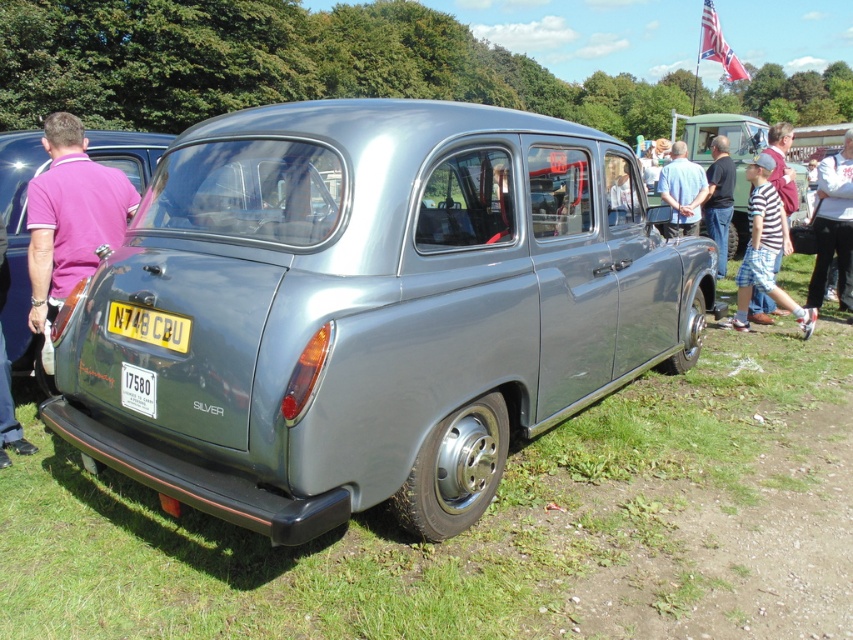
Is point (65, 195) behind point (151, 324)?

Yes, point (65, 195) is farther from viewer.

Which is in front, point (117, 208) or point (131, 324)?

Point (131, 324) is in front.

I want to click on purple cotton polo shirt at rear, so click(70, 216).

In order to click on satin silver car at center in this screenshot , I will do `click(370, 308)`.

Is satin silver car at center in front of blue shirt at center?

Yes.

Which is in front, point (575, 317) or point (669, 186)?

Point (575, 317) is more forward.

Identify the location of satin silver car at center. The image size is (853, 640). (370, 308).

Can you confirm if striped fabric shirt at right is thinner than black fabric shirt at center?

In fact, striped fabric shirt at right might be wider than black fabric shirt at center.

Is point (786, 237) less distant than point (711, 184)?

That is True.

Where is `striped fabric shirt at right`? The image size is (853, 640). striped fabric shirt at right is located at coordinates (764, 248).